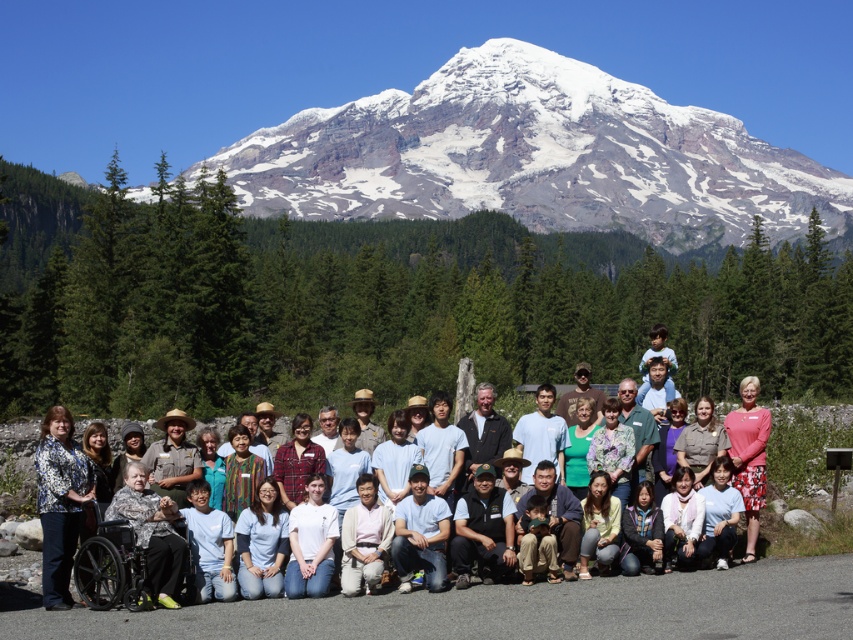
You are a photographer trying to capture a photo of the group. You notice the black plastic wheelchair at lower left and the pink fabric dress at lower right. Which object should you adjust your camera focus to ensure both are in frame without moving the group?

The black plastic wheelchair at lower left is smaller than the pink fabric dress at lower right. To ensure both are in frame, adjust the camera focus to include the entire area from the lower left to the lower right where both objects are positioned.